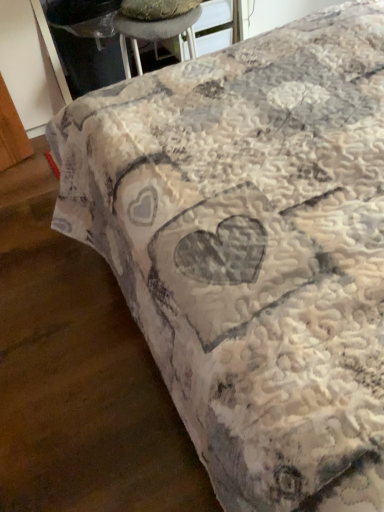
Measure the distance between white textured table at upper center and camera.

white textured table at upper center and camera are 1.53 meters apart from each other.

What do you see at coordinates (82, 28) in the screenshot?
I see `white textured table at upper center` at bounding box center [82, 28].

The width and height of the screenshot is (384, 512). What are the coordinates of `white textured table at upper center` in the screenshot? It's located at (82, 28).

Where is `white textured table at upper center`? This screenshot has height=512, width=384. white textured table at upper center is located at coordinates (82, 28).